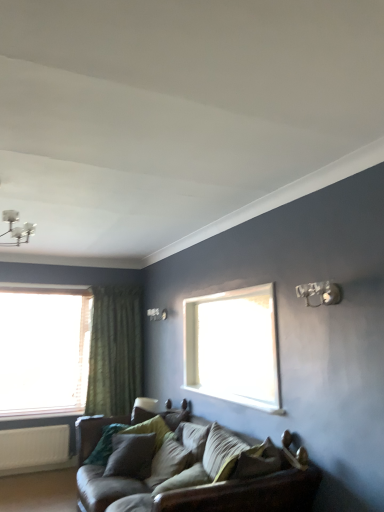
Question: From a real-world perspective, is green textured curtain at left physically above metallic silver light fixture at upper right?

Choices:
 (A) yes
 (B) no

Answer: (B)

Question: From the image's perspective, is green textured curtain at left over metallic silver light fixture at upper right?

Choices:
 (A) no
 (B) yes

Answer: (A)

Question: Considering the relative sizes of green textured curtain at left and metallic silver light fixture at upper right in the image provided, is green textured curtain at left smaller than metallic silver light fixture at upper right?

Choices:
 (A) no
 (B) yes

Answer: (A)

Question: Would you say metallic silver light fixture at upper right is part of green textured curtain at left's contents?

Choices:
 (A) yes
 (B) no

Answer: (B)

Question: Is green textured curtain at left to the right of metallic silver light fixture at upper right from the viewer's perspective?

Choices:
 (A) yes
 (B) no

Answer: (B)

Question: Is green textured curtain at left situated inside velvet green pillow at center, which appears as the second pillow when viewed from the front, or outside?

Choices:
 (A) outside
 (B) inside

Answer: (A)

Question: From the image's perspective, is green textured curtain at left positioned above or below velvet green pillow at center, which appears as the second pillow when viewed from the front?

Choices:
 (A) above
 (B) below

Answer: (A)

Question: From a real-world perspective, is green textured curtain at left physically located above or below velvet green pillow at center, which appears as the second pillow when viewed from the back?

Choices:
 (A) above
 (B) below

Answer: (A)

Question: In terms of width, does green textured curtain at left look wider or thinner when compared to velvet green pillow at center, which appears as the second pillow when viewed from the front?

Choices:
 (A) wide
 (B) thin

Answer: (B)

Question: Considering the positions of point (150, 432) and point (94, 296), is point (150, 432) closer or farther from the camera than point (94, 296)?

Choices:
 (A) farther
 (B) closer

Answer: (B)

Question: From the image's perspective, is velvet green pillow at center, which is counted as the third pillow, starting from the front, above or below green textured curtain at left?

Choices:
 (A) above
 (B) below

Answer: (B)

Question: Considering the positions of velvet green pillow at center, which is counted as the third pillow, starting from the front, and green textured curtain at left in the image, is velvet green pillow at center, which is counted as the third pillow, starting from the front, taller or shorter than green textured curtain at left?

Choices:
 (A) tall
 (B) short

Answer: (B)

Question: From a real-world perspective, is velvet green pillow at center, which is counted as the third pillow, starting from the front, above or below green textured curtain at left?

Choices:
 (A) below
 (B) above

Answer: (A)

Question: In the image, is leather couch at lower center positioned in front of or behind green textured curtain at left?

Choices:
 (A) behind
 (B) front

Answer: (B)

Question: Considering the positions of leather couch at lower center and green textured curtain at left in the image, is leather couch at lower center wider or thinner than green textured curtain at left?

Choices:
 (A) thin
 (B) wide

Answer: (B)